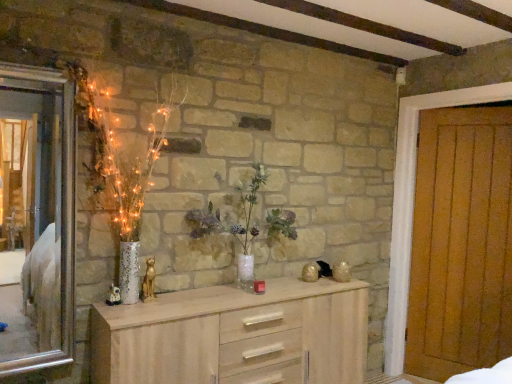
Question: From the image's perspective, is silver metallic mirror at left positioned above or below translucent glass vase at center?

Choices:
 (A) below
 (B) above

Answer: (B)

Question: Is point (57, 221) closer or farther from the camera than point (216, 215)?

Choices:
 (A) closer
 (B) farther

Answer: (A)

Question: Which is farther from the translucent glass vase at center?

Choices:
 (A) wooden door at right
 (B) light wood chest of drawers at center
 (C) silver metallic mirror at left

Answer: (C)

Question: Which of these objects is positioned closest to the silver metallic mirror at left?

Choices:
 (A) wooden door at right
 (B) translucent glass vase at center
 (C) light wood chest of drawers at center

Answer: (C)